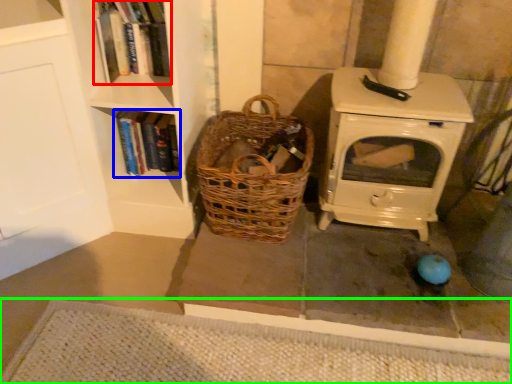
Question: Considering the real-world distances, which object is farthest from book (highlighted by a red box)? book (highlighted by a blue box) or doormat (highlighted by a green box)?

Choices:
 (A) book
 (B) doormat

Answer: (B)